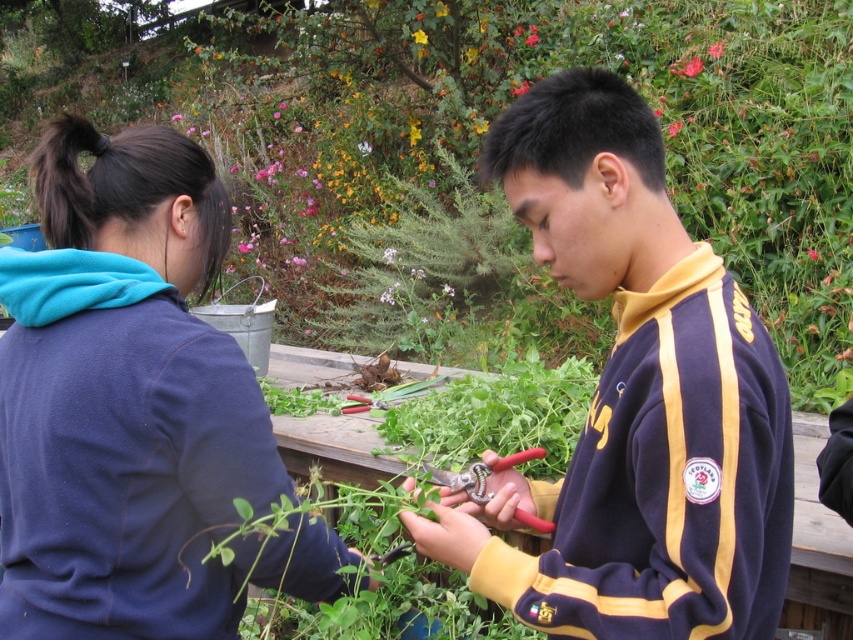
You are standing in the garden and want to reach the point at coordinates (720, 40). If your walking speed is 3 feet per second, how long will it take you to reach that point?

The point at coordinates (720, 40) is 15.68 feet away from the viewer. At a walking speed of 3 feet per second, it would take approximately 5.23 seconds to reach it.

You are standing at the point marked as point (724, 568). You need to hand a tool to the person on the right. Can you reach them without moving from your current position?

The distance between you and the person on the right is 32.34 inches. Since the average human arm length is about 25 inches, you would not be able to reach them without moving.